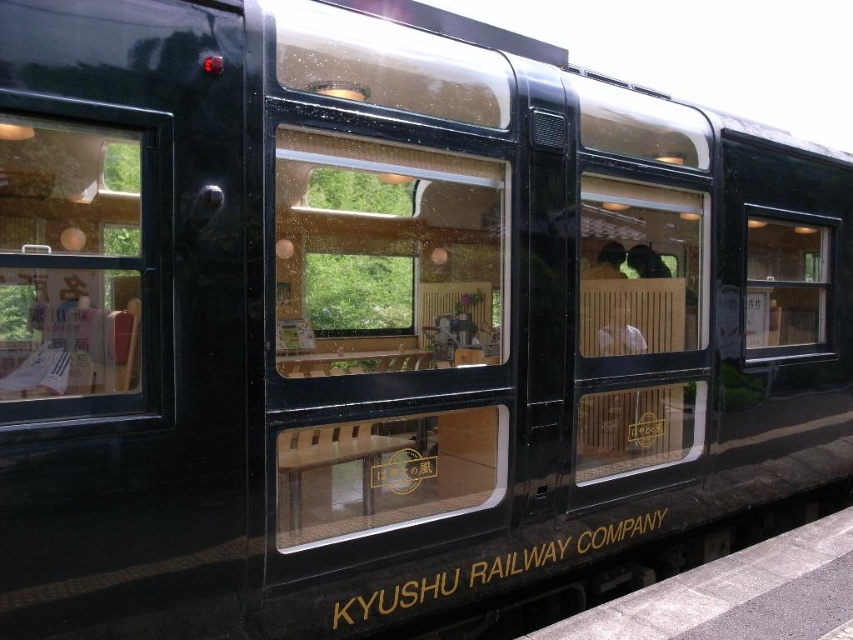
Question: Which point is closer to the camera taking this photo?

Choices:
 (A) (590, 436)
 (B) (155, 314)
 (C) (383, 195)

Answer: (B)

Question: Does transparent glass train window at center have a larger size compared to clear glass window at center?

Choices:
 (A) yes
 (B) no

Answer: (A)

Question: Which point is farther from the camera taking this photo?

Choices:
 (A) (792, 280)
 (B) (282, 483)

Answer: (A)

Question: Can you confirm if transparent glass train window at center is positioned above clear glass window at right?

Choices:
 (A) no
 (B) yes

Answer: (A)

Question: Is the position of transparent glass window at left more distant than that of clear glass window at right?

Choices:
 (A) no
 (B) yes

Answer: (A)

Question: Among these points, which one is nearest to the camera?

Choices:
 (A) (86, 355)
 (B) (785, 276)

Answer: (A)